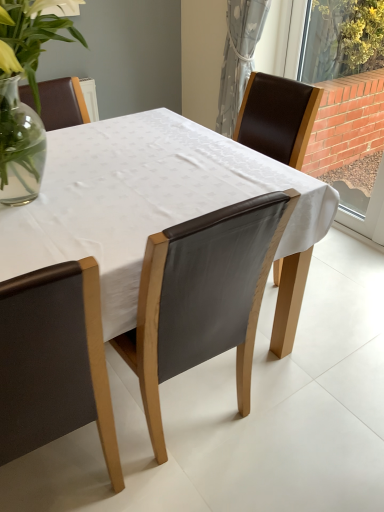
Question: Considering the relative positions of white fabric table at center and brick wall at right in the image provided, is white fabric table at center to the right of brick wall at right from the viewer's perspective?

Choices:
 (A) yes
 (B) no

Answer: (B)

Question: From the image's perspective, is white fabric table at center under brick wall at right?

Choices:
 (A) no
 (B) yes

Answer: (B)

Question: Is the depth of white fabric table at center less than that of brick wall at right?

Choices:
 (A) yes
 (B) no

Answer: (A)

Question: Would you say brick wall at right is part of white fabric table at center's contents?

Choices:
 (A) yes
 (B) no

Answer: (B)

Question: Does white fabric table at center have a greater width compared to brick wall at right?

Choices:
 (A) no
 (B) yes

Answer: (B)

Question: Choose the correct answer: Is matte brown leather chair at lower left, placed as the 1th chair when sorted from left to right, inside brick wall at right or outside it?

Choices:
 (A) outside
 (B) inside

Answer: (A)

Question: In terms of height, does matte brown leather chair at lower left, which is the 2th chair from right to left, look taller or shorter compared to brick wall at right?

Choices:
 (A) short
 (B) tall

Answer: (A)

Question: Based on their sizes in the image, would you say matte brown leather chair at lower left, which is the 2th chair from right to left, is bigger or smaller than brick wall at right?

Choices:
 (A) big
 (B) small

Answer: (A)

Question: From a real-world perspective, is matte brown leather chair at lower left, placed as the 1th chair when sorted from left to right, positioned above or below brick wall at right?

Choices:
 (A) above
 (B) below

Answer: (B)

Question: Choose the correct answer: Is white fabric table at center inside brick wall at right or outside it?

Choices:
 (A) outside
 (B) inside

Answer: (A)

Question: From a real-world perspective, relative to brick wall at right, is white fabric table at center vertically above or below?

Choices:
 (A) below
 (B) above

Answer: (A)

Question: From their relative heights in the image, would you say white fabric table at center is taller or shorter than brick wall at right?

Choices:
 (A) tall
 (B) short

Answer: (B)

Question: Is white fabric table at center in front of or behind brick wall at right in the image?

Choices:
 (A) behind
 (B) front

Answer: (B)

Question: Considering the positions of point (357, 104) and point (3, 349), is point (357, 104) closer or farther from the camera than point (3, 349)?

Choices:
 (A) closer
 (B) farther

Answer: (B)

Question: Looking at their shapes, would you say brick wall at right is wider or thinner than matte brown leather chair at lower left, which is the 2th chair from right to left?

Choices:
 (A) thin
 (B) wide

Answer: (A)